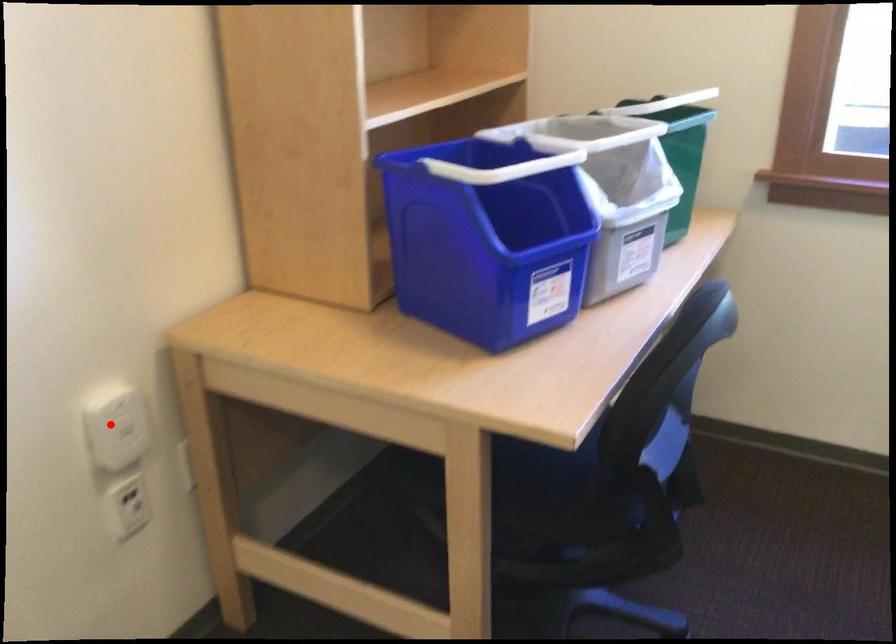
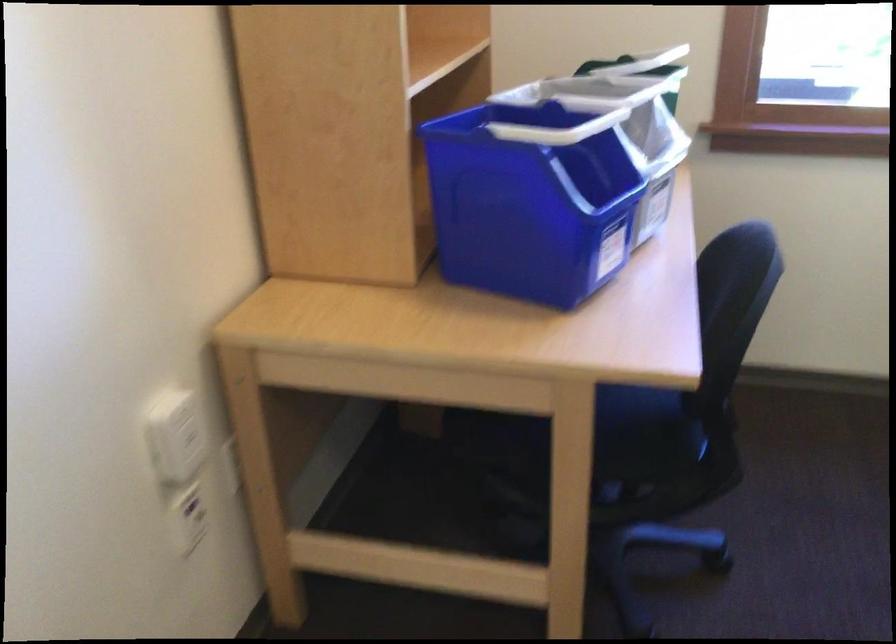
Where in the second image is the point corresponding to the highlighted location from the first image?

(174, 435)